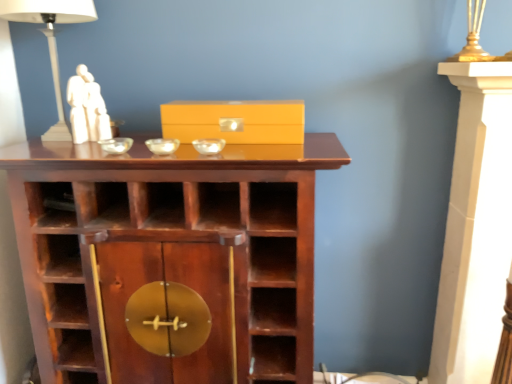
The height and width of the screenshot is (384, 512). In order to click on free space to the right of transparent glass bowl at center, which appears as the second glass bowl when viewed from the left in this screenshot , I will do `click(222, 141)`.